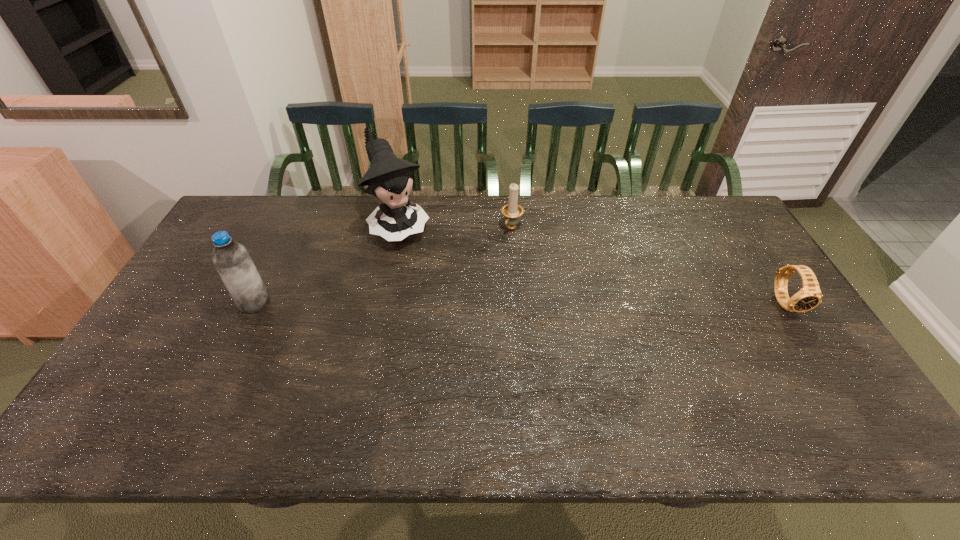
This screenshot has height=540, width=960. Find the location of `water bottle`. water bottle is located at coordinates (231, 259).

The width and height of the screenshot is (960, 540). Identify the location of the second tallest object. (231, 259).

This screenshot has height=540, width=960. I want to click on watch, so click(x=809, y=296).

I want to click on the rightmost object, so click(x=809, y=296).

Image resolution: width=960 pixels, height=540 pixels. I want to click on candle_holder, so click(512, 211).

Locate an element on the screen. the second shortest object is located at coordinates (512, 211).

The width and height of the screenshot is (960, 540). What are the coordinates of `the tallest object` in the screenshot? It's located at (389, 178).

Locate an element on the screen. The width and height of the screenshot is (960, 540). doll is located at coordinates [389, 178].

Find the location of a particular element. The image size is (960, 540). vacant space located on the right of the water bottle is located at coordinates (371, 302).

Locate an element on the screen. The image size is (960, 540). vacant space situated on the face of the shortest object is located at coordinates (824, 361).